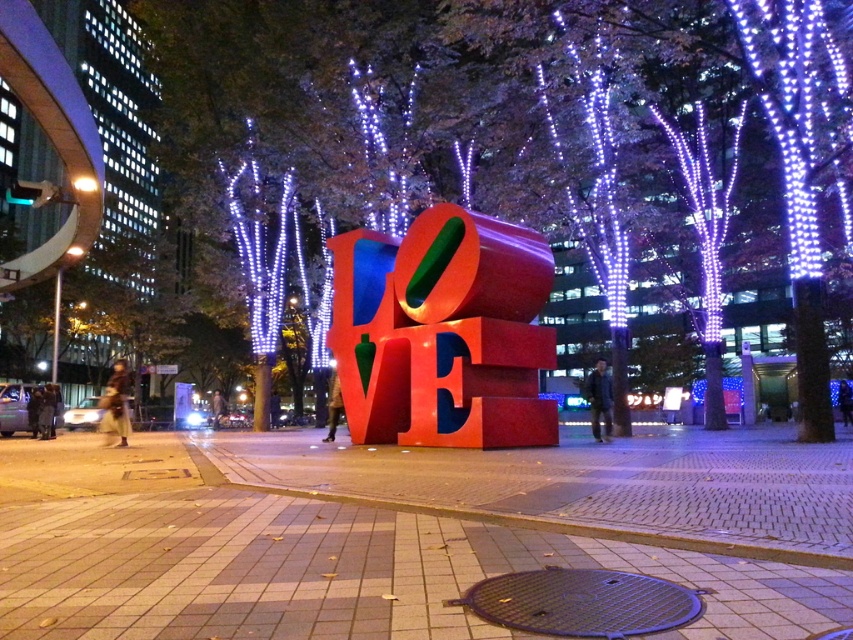
You are standing in front of the LOVE sculpture and want to take a photo. There are two points marked in the image at coordinates point (103, 499) and point (488, 326). Which point should you focus on to ensure the sculpture is sharp in your photo?

You should focus on point (103, 499) because it is closer to the camera and will ensure the sculpture is sharp in your photo.

You are a delivery person with a heavy box that needs to be placed on the brick pavement at center and the metallic brown manhole cover at lower center. Considering their heights, which surface can you place the box on without it being unstable?

The brick pavement at center has a greater height compared to the metallic brown manhole cover at lower center, so placing the box on the brick pavement at center would provide a more stable surface due to its higher elevation and possibly firmer foundation.